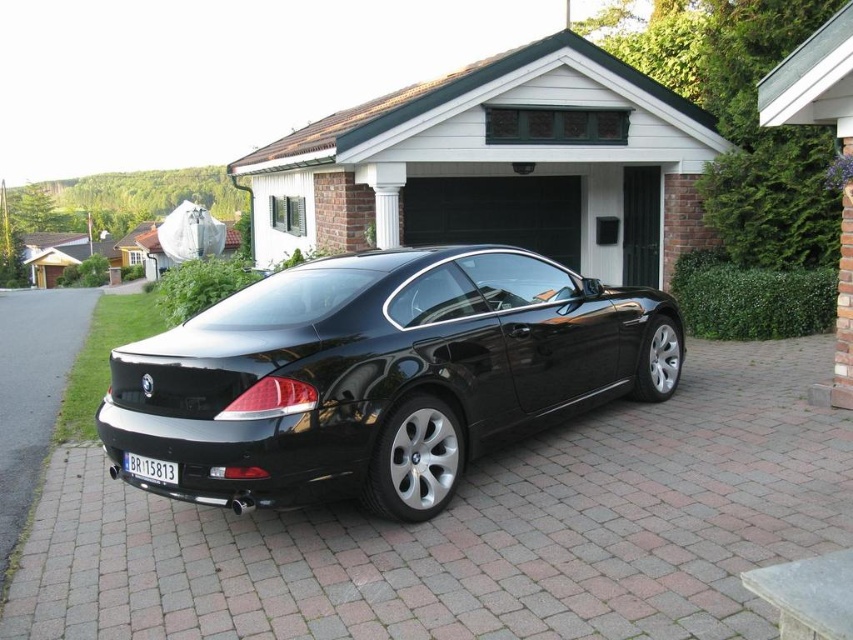
Is green wood garage door at center above brick paved driveway at lower left?

Correct, green wood garage door at center is located above brick paved driveway at lower left.

Does green wood garage door at center have a greater width compared to brick paved driveway at lower left?

Incorrect, green wood garage door at center's width does not surpass brick paved driveway at lower left's.

You are a GUI agent. You are given a task and a screenshot of the screen. Output one action in this format:
    pyautogui.click(x=<x>, y=<y>)
    Task: Click on the green wood garage door at center
    The height and width of the screenshot is (640, 853).
    Given the screenshot: What is the action you would take?
    point(497,164)

Which is behind, point (445, 451) or point (265, 186)?

The point (265, 186) is more distant.

What do you see at coordinates (378, 372) in the screenshot?
I see `glossy black car at center` at bounding box center [378, 372].

The width and height of the screenshot is (853, 640). In order to click on glossy black car at center in this screenshot , I will do point(378,372).

Is black asphalt driveway at center to the left of glossy black car at center from the viewer's perspective?

Indeed, black asphalt driveway at center is positioned on the left side of glossy black car at center.

Who is more forward, [160,564] or [415,298]?

Point [160,564] is in front.

Locate an element on the screen. The width and height of the screenshot is (853, 640). black asphalt driveway at center is located at coordinates (479, 531).